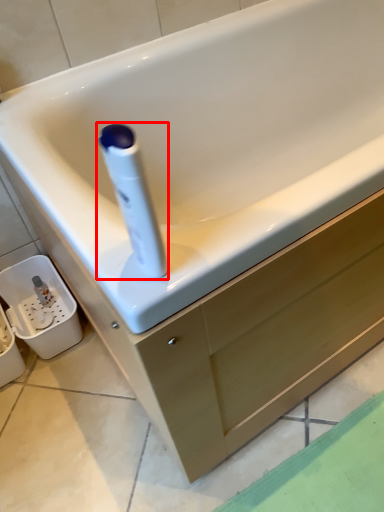
Question: Observing the image, what is the correct spatial positioning of cleaning product (annotated by the red box) in reference to drawer?

Choices:
 (A) right
 (B) left

Answer: (B)